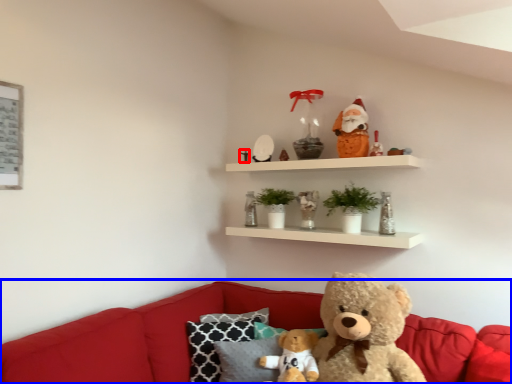
Question: Which object is closer to the camera taking this photo, toy (highlighted by a red box) or studio couch (highlighted by a blue box)?

Choices:
 (A) toy
 (B) studio couch

Answer: (B)